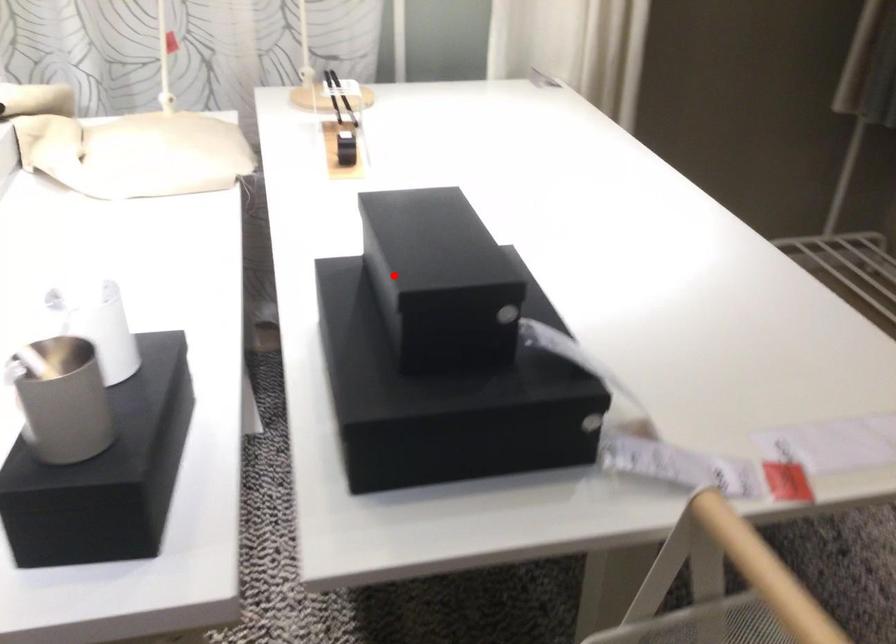
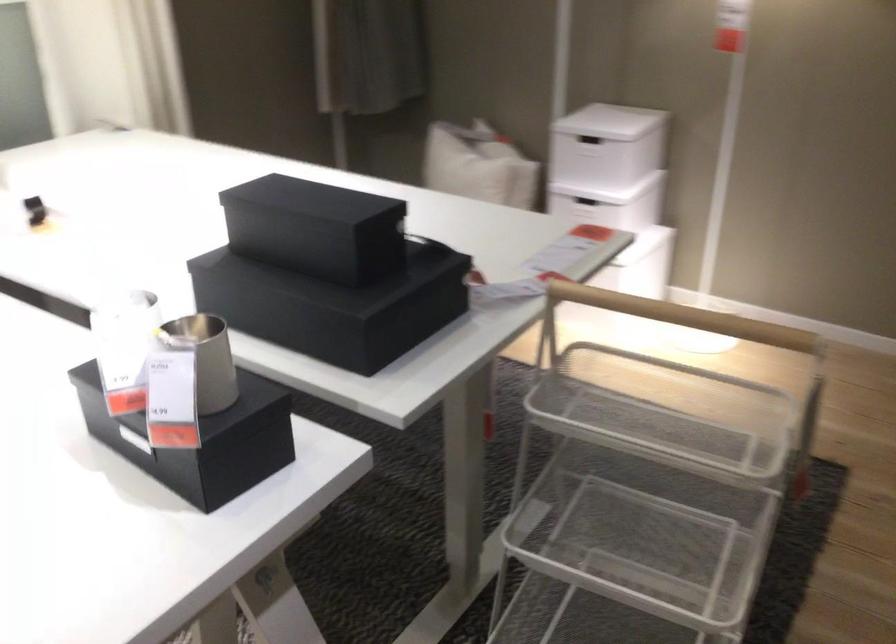
In the second image, find the point that corresponds to the highlighted location in the first image.

(315, 228)